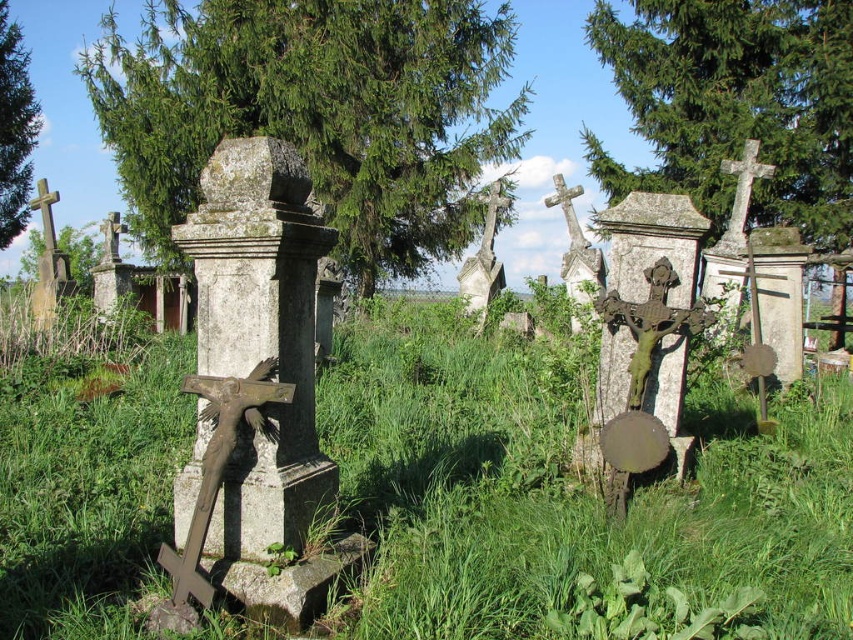
Question: Can you confirm if green leafy tree at left is positioned below stone cross at center?

Choices:
 (A) yes
 (B) no

Answer: (A)

Question: Can you confirm if green leafy tree at upper center is thinner than white stone cross at upper right?

Choices:
 (A) yes
 (B) no

Answer: (B)

Question: Which object is the farthest from the white stone cross at upper right?

Choices:
 (A) stone cross at center
 (B) green grassy at center
 (C) green leafy tree at left
 (D) green leafy tree at upper left

Answer: (D)

Question: Which point is closer to the camera?

Choices:
 (A) (82, 284)
 (B) (764, 172)
 (C) (653, 84)

Answer: (B)

Question: Is the position of green grassy at center more distant than that of green leafy tree at left?

Choices:
 (A) no
 (B) yes

Answer: (A)

Question: Which point appears farthest from the camera in this image?

Choices:
 (A) (213, 118)
 (B) (84, 243)
 (C) (3, 182)

Answer: (B)